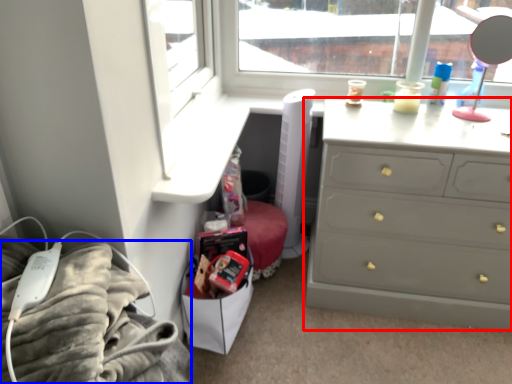
Question: Which of the following is the closest to the observer, chest of drawers (highlighted by a red box) or bedding (highlighted by a blue box)?

Choices:
 (A) chest of drawers
 (B) bedding

Answer: (B)